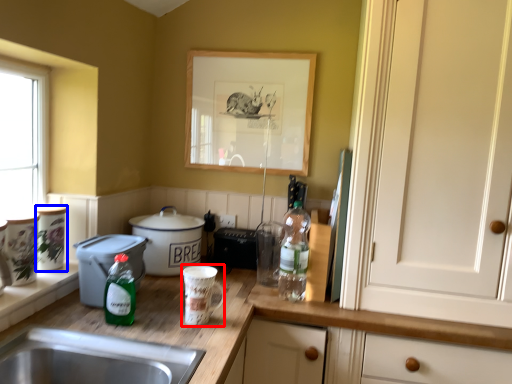
Question: Which object is closer to the camera taking this photo, appliance (highlighted by a red box) or appliance (highlighted by a blue box)?

Choices:
 (A) appliance
 (B) appliance

Answer: (A)